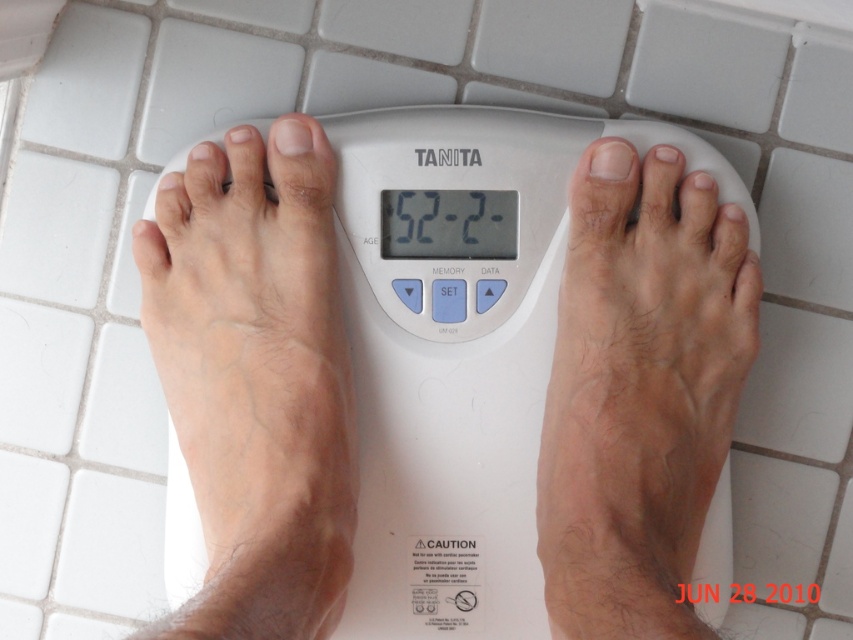
You are a physical therapist assessing a patient who is standing on the white plastic scale at center and has pale skin at center. Based on the scene, can you determine if the scale is positioned correctly for an accurate weight measurement?

The white plastic scale at center is taller than pale skin at center, which suggests the scale is elevated above the person. This elevation could affect the accuracy of the weight measurement as the scale needs to be on a flat, stable surface at ground level to ensure proper contact with the floor and accurate readings.